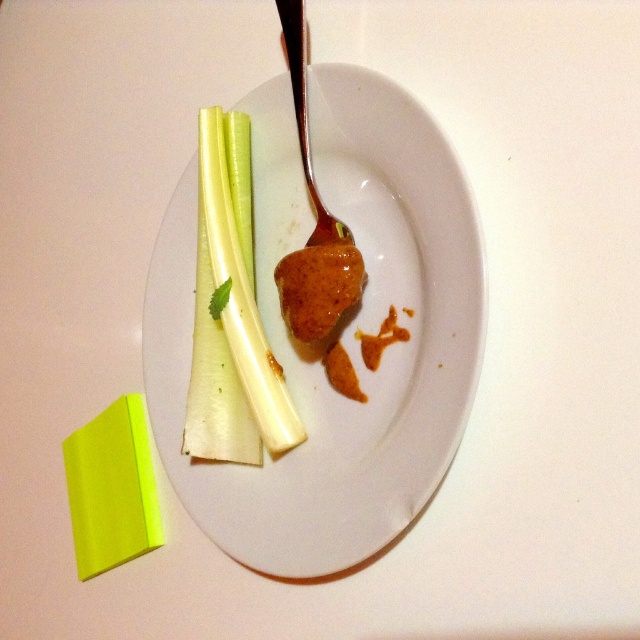
Can you confirm if white glossy plate at center is wider than neon yellow paper at lower left?

Indeed, white glossy plate at center has a greater width compared to neon yellow paper at lower left.

Which of these two, white glossy plate at center or neon yellow paper at lower left, stands taller?

With more height is white glossy plate at center.

Describe the element at coordinates (342, 333) in the screenshot. This screenshot has height=640, width=640. I see `white glossy plate at center` at that location.

Where is `white glossy plate at center`? white glossy plate at center is located at coordinates coord(342,333).

Can you confirm if white crisp celery at center is positioned to the right of neon yellow paper at lower left?

Correct, you'll find white crisp celery at center to the right of neon yellow paper at lower left.

What do you see at coordinates (230, 314) in the screenshot?
I see `white crisp celery at center` at bounding box center [230, 314].

Who is more distant from viewer, [212,317] or [140,490]?

Point [140,490]

Where is `white crisp celery at center`? This screenshot has width=640, height=640. white crisp celery at center is located at coordinates (230, 314).

Is white glossy plate at center further to the viewer compared to white crisp celery at center?

No, white glossy plate at center is closer to the viewer.

Does white glossy plate at center come in front of white crisp celery at center?

Yes, it is in front of white crisp celery at center.

Find the location of a particular element. This screenshot has width=640, height=640. white glossy plate at center is located at coordinates (342, 333).